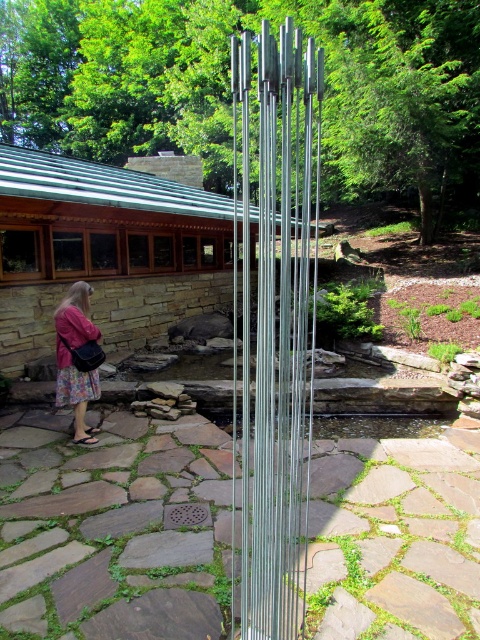
You are standing at the entrance of a garden and see the silver metallic wind chime at center and the floral skirt at lower left. Which object is wider?

The silver metallic wind chime at center is wider than the floral skirt at lower left.

You are standing at the entrance of the garden and see the silver metallic wind chime at center and the floral skirt at lower left. Which object is bigger in size?

The silver metallic wind chime at center has a larger size compared to the floral skirt at lower left.

You are standing in front of the sculpture and want to pick up the silver metallic wind chime at center and the floral skirt at lower left. Which object is easier to reach without moving your feet?

The silver metallic wind chime at center is closer to the viewer than the floral skirt at lower left, so it is easier to reach without moving your feet.